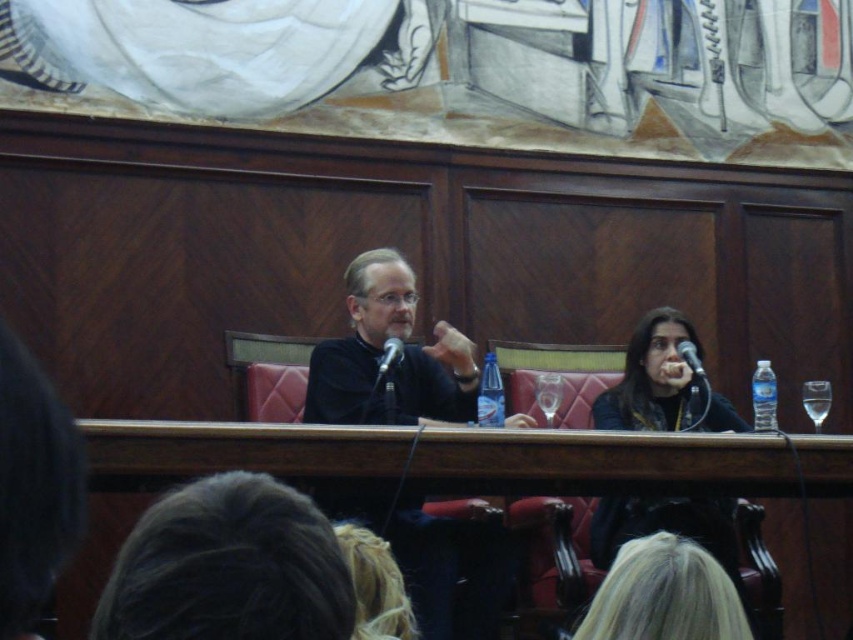
You are an event organizer setting up a stage for a presentation. You have a wooden table at center and a black fabric at center. Where should you place the main speaker microphone to ensure it is visible to the audience?

The wooden table at center is in front of the black fabric at center, so placing the main speaker microphone on the wooden table at center will ensure it is visible against the black fabric backdrop.

You are an event organizer trying to set up a camera to capture the speaker wearing the matte black shirt at center. According to the coordinates provided, where should you position the camera to best capture this speaker?

The matte black shirt at center is located at coordinates point (x=381, y=353), so positioning the camera at those coordinates would ensure the best capture of the speaker.